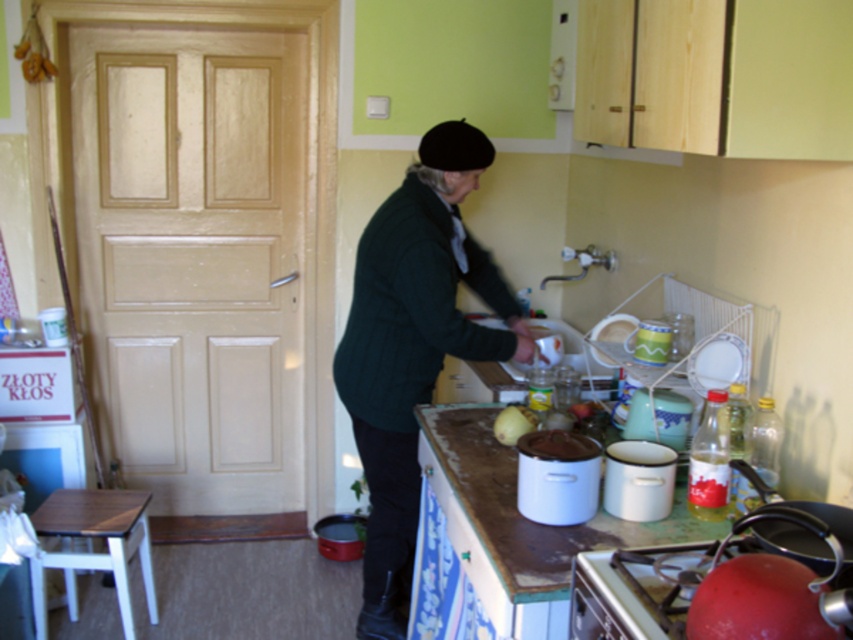
You are a person who wants to reach the top shelf of the metallic silver stove at lower right to grab a pot. Considering the height of the wooden stool at lower left, can you stand on it to reach the stove?

The metallic silver stove at lower right is shorter than the wooden stool at lower left. Since the stool is taller, standing on it may not allow you to reach the stove top shelf as the stool is actually shorter than the stove itself.

Consider the image. You are organizing a kitchen pantry and need to place the dark green sweater at center and the yellow matte onion at center into storage. Which item should you place on the lower shelf to avoid blocking the view of the other?

The yellow matte onion at center should be placed on the lower shelf because the dark green sweater at center is taller and would block the view of the onion if placed below it.